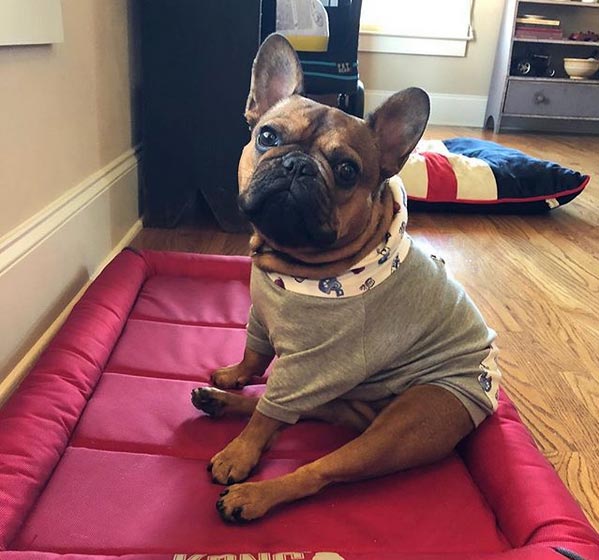
Where is `hardwood floor`? hardwood floor is located at coordinates (562, 312).